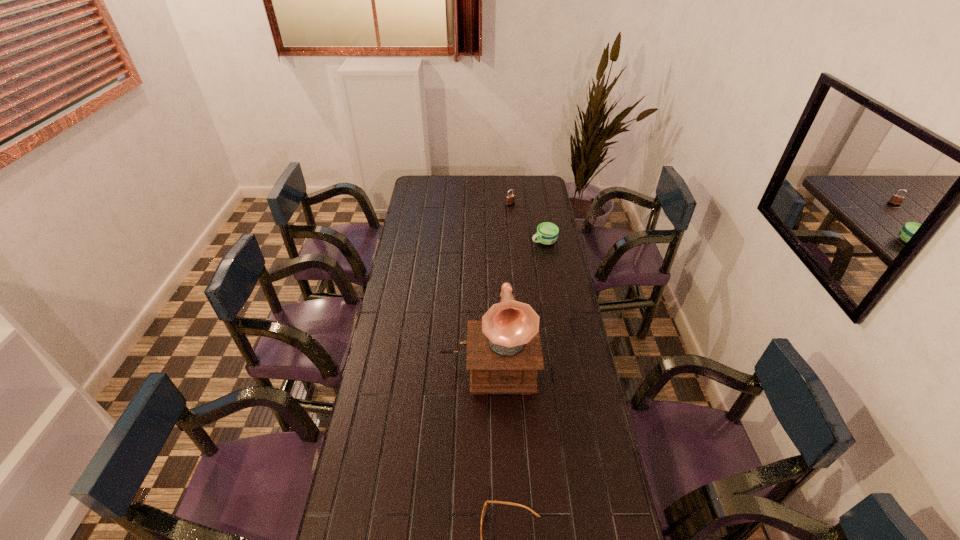
This screenshot has width=960, height=540. I want to click on the second nearest object, so click(x=504, y=353).

Locate an element on the screen. record player is located at coordinates (504, 353).

This screenshot has width=960, height=540. Identify the location of the farthest object. (510, 199).

I want to click on cup, so click(x=547, y=232).

Find the location of `the second farthest object`. the second farthest object is located at coordinates (547, 232).

The height and width of the screenshot is (540, 960). I want to click on vacant space situated 0.330m on the horn of the second nearest object, so click(x=491, y=501).

Where is `vacant region located on the front of the padlock`? The width and height of the screenshot is (960, 540). vacant region located on the front of the padlock is located at coordinates (512, 221).

Locate an element on the screen. vacant space located 0.270m on the back of the rightmost object is located at coordinates (538, 206).

Where is `object that is positioned at the right edge`? Image resolution: width=960 pixels, height=540 pixels. object that is positioned at the right edge is located at coordinates pyautogui.click(x=547, y=232).

In order to click on vacant space at the far edge in this screenshot , I will do `click(503, 185)`.